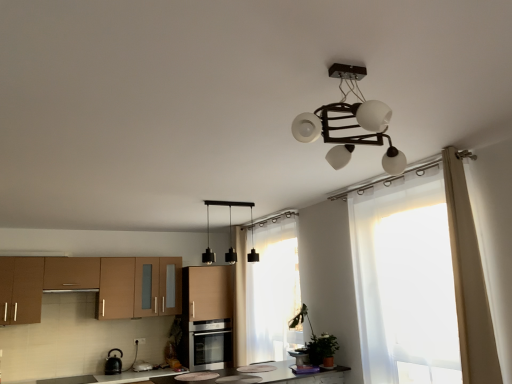
Question: From a real-world perspective, is satin silver oven at center positioned above or below brown matte cabinet at left, the second cabinetry when ordered from right to left?

Choices:
 (A) below
 (B) above

Answer: (A)

Question: Considering the positions of satin silver oven at center and brown matte cabinet at left, which appears as the 1th cabinetry when viewed from the left, in the image, is satin silver oven at center wider or thinner than brown matte cabinet at left, which appears as the 1th cabinetry when viewed from the left,?

Choices:
 (A) wide
 (B) thin

Answer: (A)

Question: Estimate the real-world distances between objects in this image. Which object is farther from the green matte plant at lower right?

Choices:
 (A) sheer white curtain at center, marked as the first curtain in a back-to-front arrangement
 (B) satin silver oven at center
 (C) translucent white curtain at right
 (D) matte black pot at center, the 2th appliance from the left
 (E) white sheer curtain at right, placed as the 1th curtain when sorted from front to back

Answer: (B)

Question: Which object is positioned closest to the translucent white curtain at right?

Choices:
 (A) white sheer curtain at right, which is counted as the second curtain, starting from the back
 (B) black glossy kettle at lower left, which is counted as the second appliance, starting from the top
 (C) satin silver oven at center
 (D) sheer white curtain at center, the second curtain from the right
 (E) brown matte cabinet at left, the second cabinetry when ordered from right to left

Answer: (A)